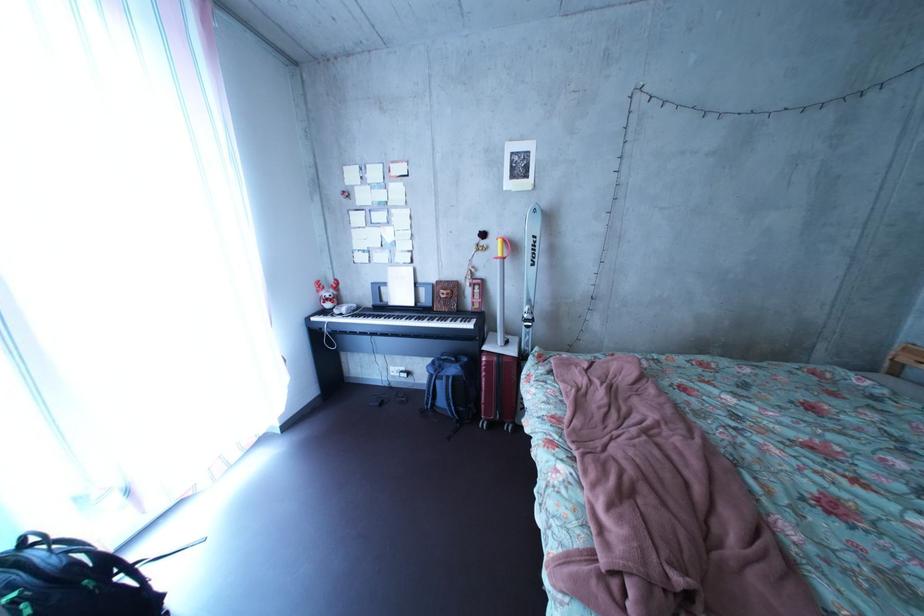
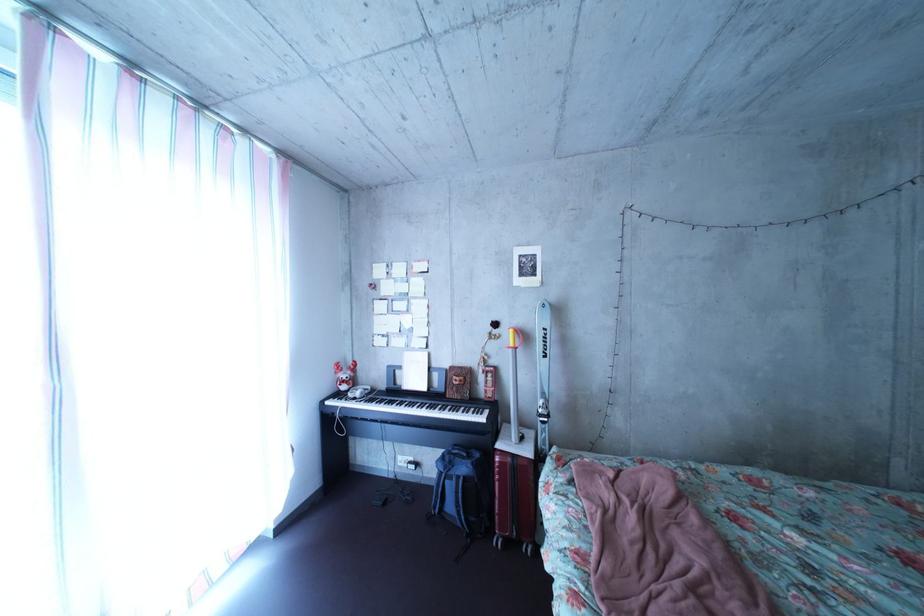
Find the pixel in the second image that matches (x=439, y=308) in the first image.

(452, 392)